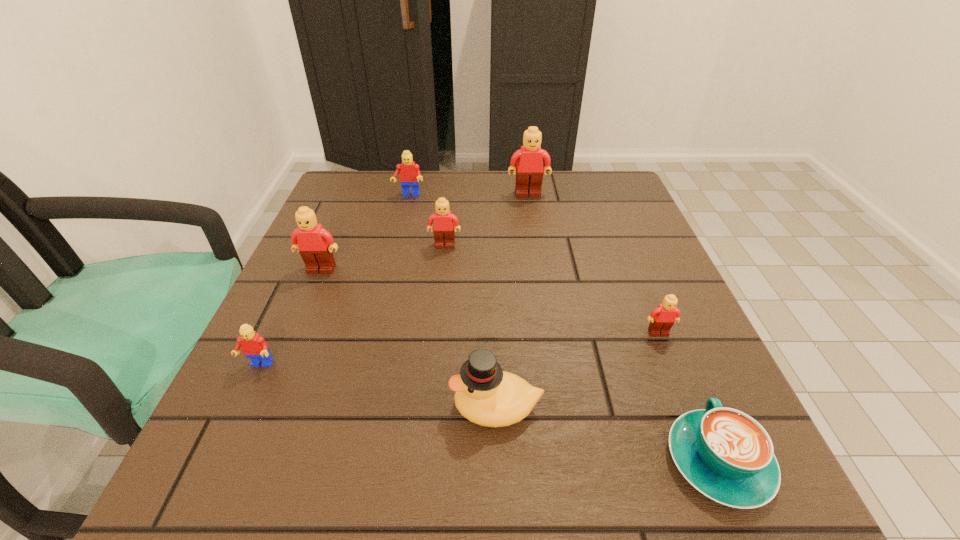
Where is `free point located 0.260m on the front-facing side of the duck`? The width and height of the screenshot is (960, 540). free point located 0.260m on the front-facing side of the duck is located at coordinates (281, 407).

At what (x,y) coordinates should I click in order to perform the action: click on free space located on the front-facing side of the duck. Please return your answer as a coordinate pair (x, y). Looking at the image, I should click on (405, 407).

Image resolution: width=960 pixels, height=540 pixels. I want to click on vacant area located 0.080m on the face of the second nearest Lego, so coord(676,374).

This screenshot has width=960, height=540. I want to click on blank space located on the front-facing side of the nearest Lego, so click(243, 399).

Where is `free spot located 0.190m with the handle on the right side of the turquoise cappuccino`? Image resolution: width=960 pixels, height=540 pixels. free spot located 0.190m with the handle on the right side of the turquoise cappuccino is located at coordinates (660, 324).

At what (x,y) coordinates should I click in order to perform the action: click on free space located 0.080m with the handle on the right side of the turquoise cappuccino. Please return your answer as a coordinate pair (x, y). Looking at the image, I should click on (682, 373).

This screenshot has height=540, width=960. I want to click on blank space located 0.240m with the handle on the right side of the turquoise cappuccino, so click(x=653, y=305).

In order to click on object at the near edge in this screenshot , I will do `click(725, 454)`.

Where is `Lego that is at the right edge`? The image size is (960, 540). Lego that is at the right edge is located at coordinates (663, 317).

Find the location of a particular element. Image resolution: width=960 pixels, height=540 pixels. cappuccino at the right edge is located at coordinates (725, 454).